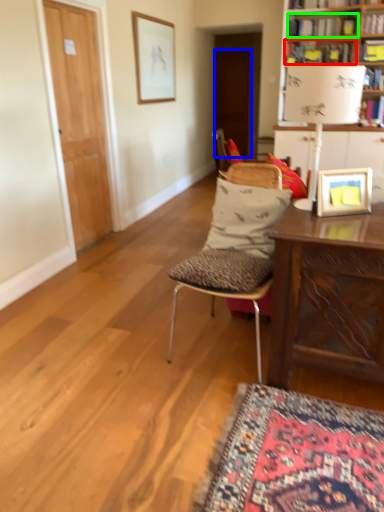
Question: Which is nearer to the book (highlighted by a red box)? door (highlighted by a blue box) or book (highlighted by a green box).

Choices:
 (A) door
 (B) book

Answer: (B)